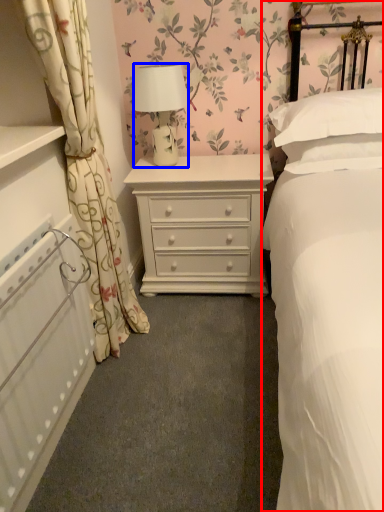
Question: Which object appears farthest to the camera in this image, bed (highlighted by a red box) or lamp (highlighted by a blue box)?

Choices:
 (A) bed
 (B) lamp

Answer: (B)